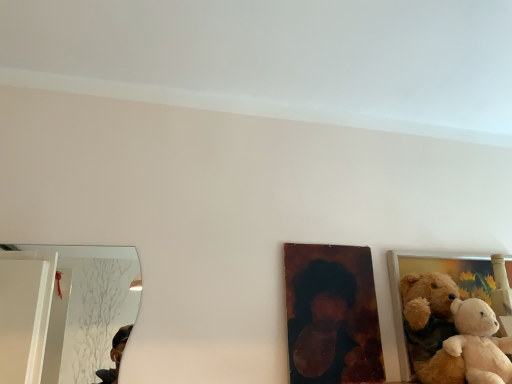
Question: Can you see fluffy fabric teddy bear at right, which is the 2th picture frame from left to right, touching soft beige plush at right?

Choices:
 (A) no
 (B) yes

Answer: (A)

Question: Does fluffy fabric teddy bear at right, which is the 2th picture frame from left to right, have a larger size compared to soft beige plush at right?

Choices:
 (A) no
 (B) yes

Answer: (B)

Question: Would you consider fluffy fabric teddy bear at right, which ranks as the 1th picture frame in right-to-left order, to be distant from soft beige plush at right?

Choices:
 (A) no
 (B) yes

Answer: (A)

Question: Is fluffy fabric teddy bear at right, which is the 2th picture frame from left to right, further to camera compared to soft beige plush at right?

Choices:
 (A) yes
 (B) no

Answer: (A)

Question: Considering the relative sizes of fluffy fabric teddy bear at right, which ranks as the 1th picture frame in right-to-left order, and soft beige plush at right in the image provided, is fluffy fabric teddy bear at right, which ranks as the 1th picture frame in right-to-left order, taller than soft beige plush at right?

Choices:
 (A) yes
 (B) no

Answer: (A)

Question: Is point (458, 375) positioned closer to the camera than point (406, 377)?

Choices:
 (A) farther
 (B) closer

Answer: (B)

Question: Is soft beige plush at right inside or outside of fluffy fabric teddy bear at right, which ranks as the 1th picture frame in right-to-left order?

Choices:
 (A) inside
 (B) outside

Answer: (B)

Question: Is soft beige plush at right in front of or behind fluffy fabric teddy bear at right, which is the 2th picture frame from left to right, in the image?

Choices:
 (A) behind
 (B) front

Answer: (B)

Question: Is soft beige plush at right wider or thinner than fluffy fabric teddy bear at right, which is the 2th picture frame from left to right?

Choices:
 (A) thin
 (B) wide

Answer: (B)

Question: Choose the correct answer: Is wooden portrait at center, the second picture frame in the right-to-left sequence, inside fluffy fabric teddy bear at right, which is the 2th picture frame from left to right, or outside it?

Choices:
 (A) outside
 (B) inside

Answer: (A)

Question: Based on their sizes in the image, would you say wooden portrait at center, the first picture frame in the left-to-right sequence, is bigger or smaller than fluffy fabric teddy bear at right, which is the 2th picture frame from left to right?

Choices:
 (A) small
 (B) big

Answer: (A)

Question: Is point (370, 317) closer or farther from the camera than point (401, 365)?

Choices:
 (A) closer
 (B) farther

Answer: (B)

Question: From the image's perspective, is wooden portrait at center, the second picture frame in the right-to-left sequence, above or below fluffy fabric teddy bear at right, which ranks as the 1th picture frame in right-to-left order?

Choices:
 (A) below
 (B) above

Answer: (B)

Question: Considering the relative positions of fluffy fabric teddy bear at right, which is the 2th picture frame from left to right, and soft beige plush at right in the image provided, is fluffy fabric teddy bear at right, which is the 2th picture frame from left to right, to the left or to the right of soft beige plush at right?

Choices:
 (A) right
 (B) left

Answer: (A)

Question: Would you say fluffy fabric teddy bear at right, which is the 2th picture frame from left to right, is inside or outside soft beige plush at right?

Choices:
 (A) inside
 (B) outside

Answer: (B)